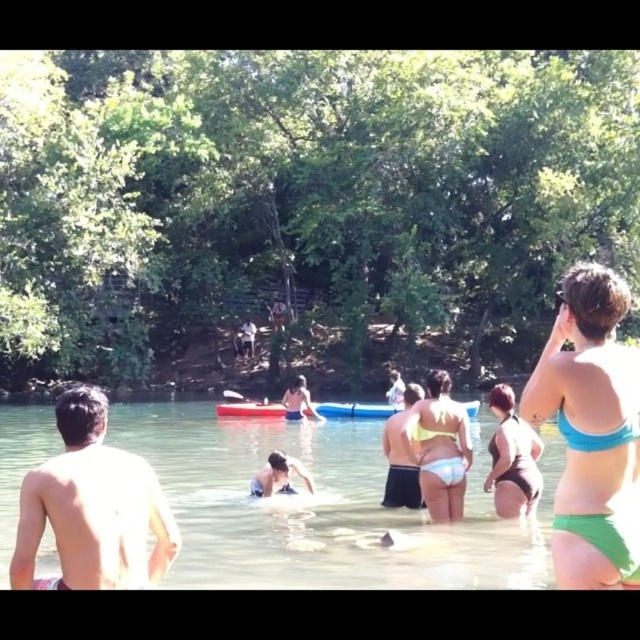
Locate an element on the screen. blue matte bikini top at upper right is located at coordinates tap(596, 435).

Between point (609, 438) and point (285, 470), which one is positioned behind?

The point (285, 470) is more distant.

Identify the location of blue matte bikini top at upper right. (596, 435).

Between blue matte bikini top at upper right and white plastic paddle at center, which one appears on the right side from the viewer's perspective?

blue matte bikini top at upper right

Who is shorter, blue matte bikini top at upper right or white plastic paddle at center?

blue matte bikini top at upper right

What do you see at coordinates (596, 435) in the screenshot? I see `blue matte bikini top at upper right` at bounding box center [596, 435].

At what (x,y) coordinates should I click in order to perform the action: click on blue matte bikini top at upper right. Please return your answer as a coordinate pair (x, y). This screenshot has height=640, width=640. Looking at the image, I should click on (596, 435).

Is point (420, 444) farther from viewer compared to point (500, 461)?

Yes, point (420, 444) is farther from viewer.

The image size is (640, 640). Find the location of `yellow bikini bottom at center`. yellow bikini bottom at center is located at coordinates (440, 449).

Find the location of a particular element. The image size is (640, 640). yellow bikini bottom at center is located at coordinates (440, 449).